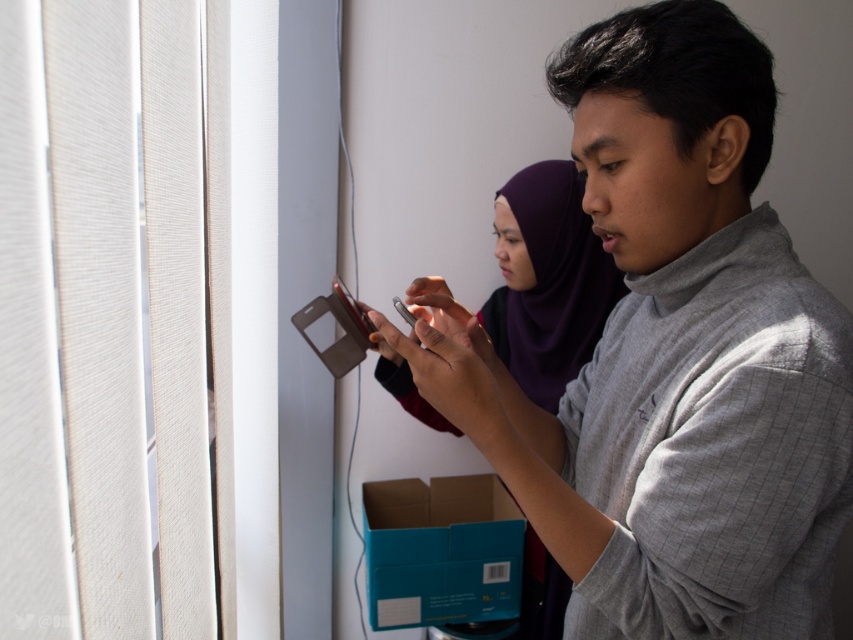
Can you confirm if gray textured sweater at center is taller than white paper at lower center?

Indeed, gray textured sweater at center has a greater height compared to white paper at lower center.

Can you confirm if gray textured sweater at center is positioned below white paper at lower center?

Incorrect, gray textured sweater at center is not positioned below white paper at lower center.

Where is `gray textured sweater at center`? gray textured sweater at center is located at coordinates (674, 356).

Where is `gray textured sweater at center`? This screenshot has width=853, height=640. gray textured sweater at center is located at coordinates (674, 356).

Between point (662, 340) and point (399, 545), which one is positioned in front?

Point (662, 340) is more forward.

Can you confirm if gray textured sweater at center is wider than teal cardboard box at lower center?

Yes.

Does point (807, 387) come closer to viewer compared to point (386, 618)?

Yes, it is.

Find the location of `gray textured sweater at center`. gray textured sweater at center is located at coordinates (674, 356).

Does teal cardboard box at lower center have a smaller size compared to white paper at lower center?

No.

Does teal cardboard box at lower center lie in front of white paper at lower center?

Yes.

Find the location of a particular element. This screenshot has width=853, height=640. teal cardboard box at lower center is located at coordinates (440, 548).